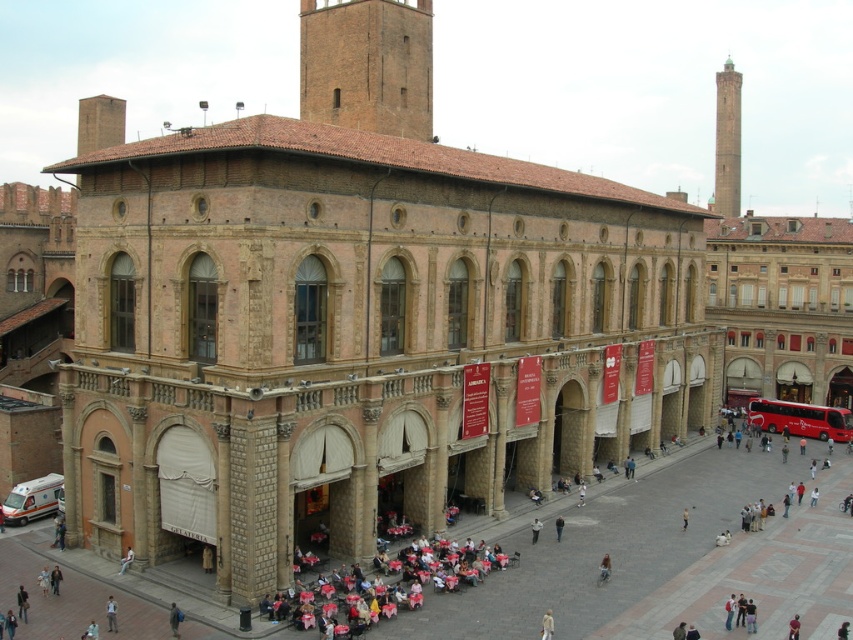
Does red metallic bus at lower right appear under light beige fabric at lower center?

No, red metallic bus at lower right is not below light beige fabric at lower center.

Find the location of a particular element. red metallic bus at lower right is located at coordinates (799, 419).

Between smooth stone tower at upper right and light beige fabric at lower center, which one is positioned higher?

smooth stone tower at upper right

Is smooth stone tower at upper right below light beige fabric at lower center?

No.

I want to click on smooth stone tower at upper right, so click(727, 141).

The height and width of the screenshot is (640, 853). I want to click on smooth stone tower at upper right, so click(x=727, y=141).

Between point (405, 86) and point (108, 620), which one is positioned in front?

Positioned in front is point (108, 620).

Is brick tower at upper center bigger than light blue denim jacket at lower center?

Indeed, brick tower at upper center has a larger size compared to light blue denim jacket at lower center.

This screenshot has height=640, width=853. I want to click on brick tower at upper center, so click(367, 65).